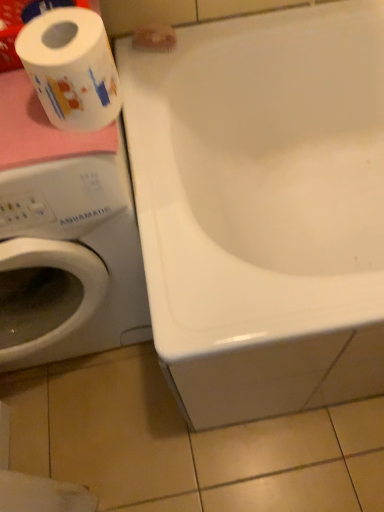
Locate an element on the screen. Image resolution: width=384 pixels, height=512 pixels. free location to the right of white matte toilet paper at upper center, placed as the 1th toilet paper when sorted from back to front is located at coordinates (221, 39).